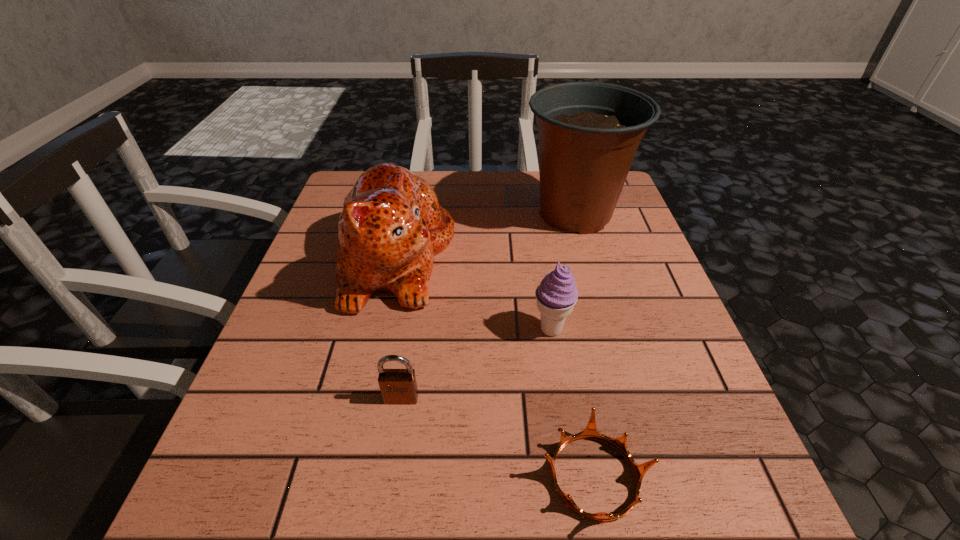
I want to click on object positioned at the near right corner, so click(590, 432).

I want to click on vacant space at the far edge of the desktop, so click(537, 184).

This screenshot has width=960, height=540. What are the coordinates of `free space at the near edge of the desktop` in the screenshot? It's located at (520, 482).

In the image, there is a desktop. Identify the location of free region at the left edge. (296, 290).

In the image, there is a desktop. Where is `vacant region at the right edge`? This screenshot has width=960, height=540. vacant region at the right edge is located at coordinates (680, 438).

The image size is (960, 540). I want to click on free point at the near right corner, so click(x=758, y=534).

Locate an element on the screen. This screenshot has width=960, height=540. free space between the third shortest object and the shortest object is located at coordinates (573, 403).

Find the location of a particular element. The width and height of the screenshot is (960, 540). empty space that is in between the flowerpot and the nearest object is located at coordinates (585, 346).

The image size is (960, 540). I want to click on free space that is in between the icecream and the fourth farthest object, so click(476, 364).

Locate an element on the screen. The image size is (960, 540). vacant space in between the icecream and the fourth shortest object is located at coordinates (473, 293).